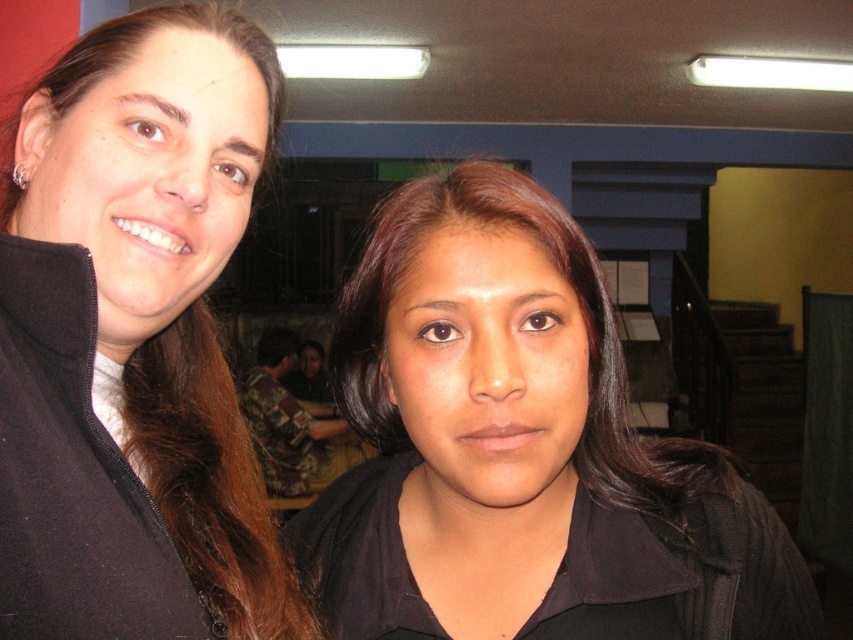
You are a photographer setting up for a group photo. You have two jackets, the black matte jacket at center and the matte black jacket at left. The jackets need to be placed exactly 15 centimeters apart for the composition. Based on their current positions, do they need to be moved closer or farther apart?

The black matte jacket at center is currently 13.31 centimeters from the matte black jacket at left. Since 13.31 cm is less than 15 cm, the jackets need to be moved farther apart to achieve the required distance.